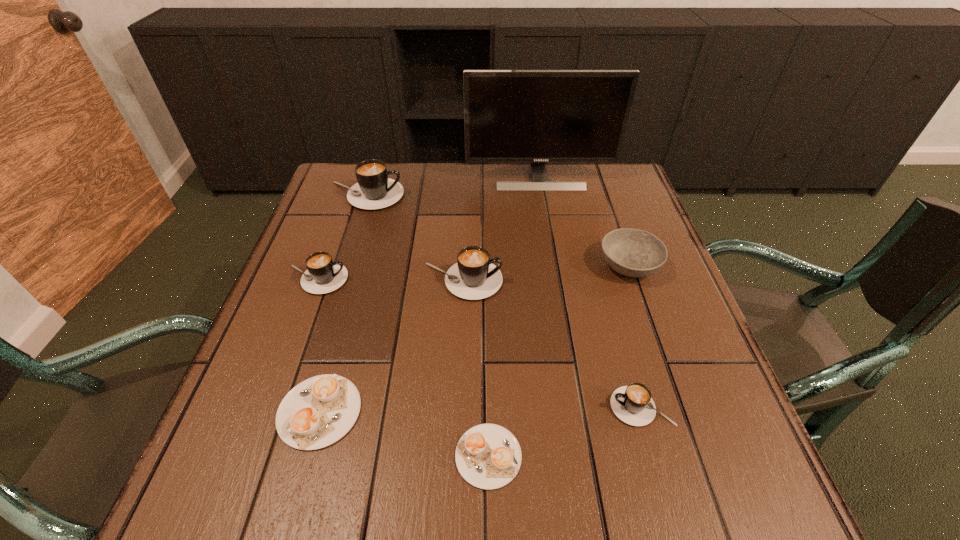
The width and height of the screenshot is (960, 540). I want to click on object that is at the far right corner, so click(537, 116).

This screenshot has height=540, width=960. In the image, there is a desktop. Identify the location of vacant space at the far edge. (456, 197).

At what (x,y) coordinates should I click in order to perform the action: click on vacant space at the near edge. Please return your answer as a coordinate pair (x, y). Image resolution: width=960 pixels, height=540 pixels. Looking at the image, I should click on (468, 491).

Where is `vacant space at the left edge of the desktop`? vacant space at the left edge of the desktop is located at coordinates (315, 301).

Where is `vacant space at the right edge of the desktop`? Image resolution: width=960 pixels, height=540 pixels. vacant space at the right edge of the desktop is located at coordinates (620, 226).

The height and width of the screenshot is (540, 960). In order to click on free space between the third tallest cappuccino and the shortest object in this screenshot , I will do `click(402, 368)`.

The height and width of the screenshot is (540, 960). In order to click on vacant region between the shortest object and the bigger white cappuccino in this screenshot , I will do `click(404, 434)`.

At what (x,y) coordinates should I click in order to perform the action: click on empty space that is in between the second tallest cappuccino and the rightmost cappuccino. Please return your answer as a coordinate pair (x, y). Looking at the image, I should click on (552, 344).

Locate an element on the screen. This screenshot has width=960, height=540. vacant space that's between the second tallest cappuccino and the right white cappuccino is located at coordinates (475, 368).

Locate an element on the screen. The height and width of the screenshot is (540, 960). blank region between the third tallest object and the farthest black cappuccino is located at coordinates (414, 238).